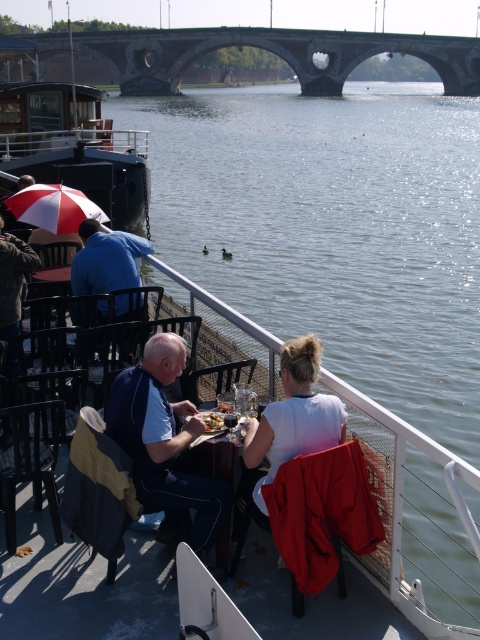
Is wooden table at center wider than matte black umbrella at left?

In fact, wooden table at center might be narrower than matte black umbrella at left.

Is point (226, 518) positioned before point (9, 212)?

Yes.

Between point (212, 458) and point (8, 211), which one is positioned behind?

Point (8, 211)

What are the coordinates of `wooden table at center` in the screenshot? It's located at (218, 458).

Does blue fabric shirt at center have a greater height compared to red and white striped umbrella at left?

Correct, blue fabric shirt at center is much taller as red and white striped umbrella at left.

Does blue fabric shirt at center have a smaller size compared to red and white striped umbrella at left?

Correct, blue fabric shirt at center occupies less space than red and white striped umbrella at left.

The width and height of the screenshot is (480, 640). Identify the location of blue fabric shirt at center. (166, 445).

The height and width of the screenshot is (640, 480). I want to click on blue fabric shirt at center, so click(x=166, y=445).

Is point (80, 278) less distant than point (6, 209)?

Yes.

From the picture: Who is lower down, blue cotton shirt at left or matte black umbrella at left?

blue cotton shirt at left

This screenshot has width=480, height=640. Describe the element at coordinates (107, 259) in the screenshot. I see `blue cotton shirt at left` at that location.

This screenshot has width=480, height=640. Find the location of `blue cotton shirt at left`. blue cotton shirt at left is located at coordinates (107, 259).